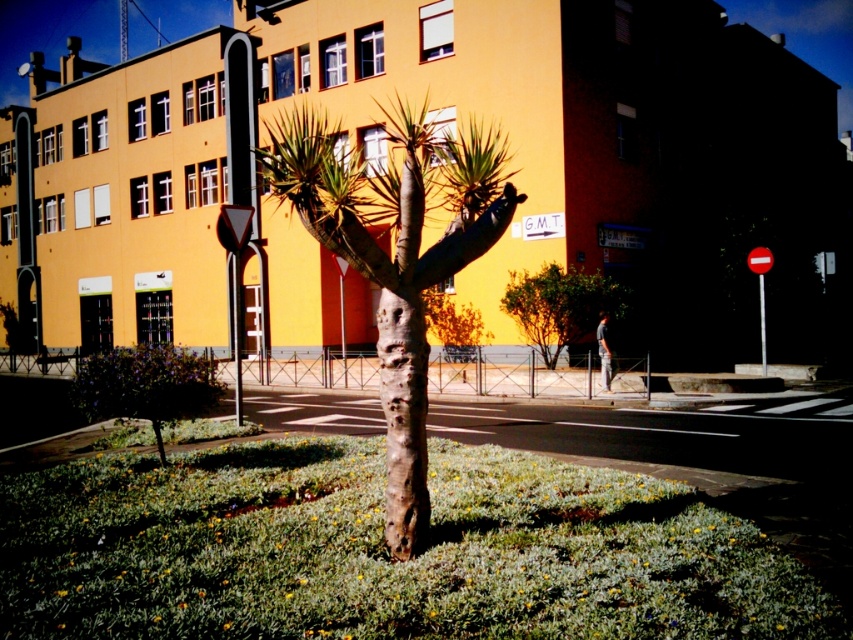
Does green leafy bush at center have a greater width compared to red plastic sign at right?

Yes, green leafy bush at center is wider than red plastic sign at right.

Does green leafy bush at center appear on the left side of red plastic sign at right?

Indeed, green leafy bush at center is positioned on the left side of red plastic sign at right.

This screenshot has width=853, height=640. What do you see at coordinates (560, 307) in the screenshot?
I see `green leafy bush at center` at bounding box center [560, 307].

I want to click on green leafy bush at center, so pos(560,307).

Is brown rough bark tree at center positioned before red plastic sign at right?

Yes, it is.

Consider the image. Which is more to the left, brown rough bark tree at center or red plastic sign at right?

brown rough bark tree at center

Between point (277, 180) and point (762, 316), which one is positioned behind?

Point (762, 316)

The image size is (853, 640). I want to click on brown rough bark tree at center, so (396, 256).

Does brown rough bark tree at center have a greater width compared to green matte tree at lower left?

Yes.

Who is positioned more to the right, brown rough bark tree at center or green matte tree at lower left?

Positioned to the right is brown rough bark tree at center.

Which is behind, point (381, 227) or point (172, 346)?

The point (381, 227) is more distant.

The image size is (853, 640). Identify the location of brown rough bark tree at center. (396, 256).